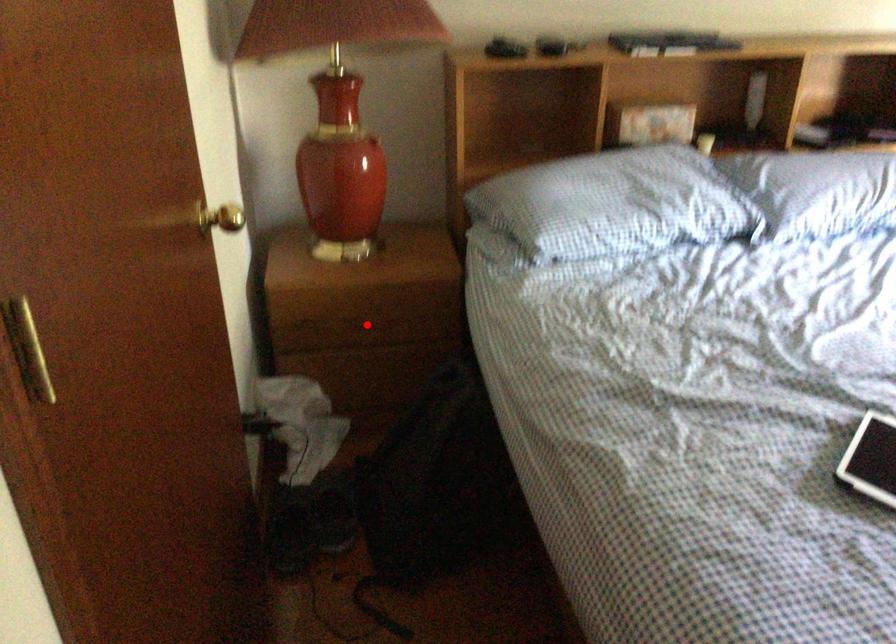
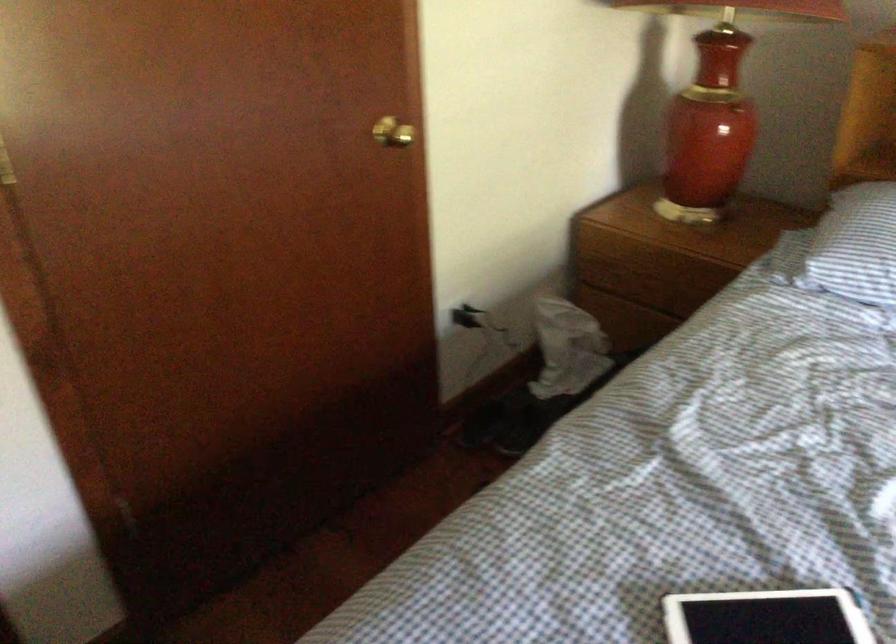
In the second image, find the point that corresponds to the highlighted location in the first image.

(650, 283)